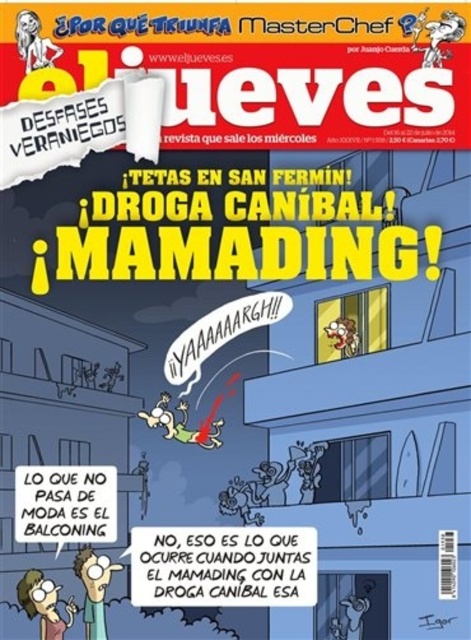
In the scene shown: What is the color of the shirt located at the lower left position marked by the point (43, 604)?

The point (43, 604) marks the matte green shirt at lower left, so the color is green.

You are a photographer trying to capture the magazine cover. You notice two points marked on the cover. Which point, point (63, 637) or point (97, 586), is closer to your camera lens?

Point (63, 637) is closer to the camera lens than point (97, 586).